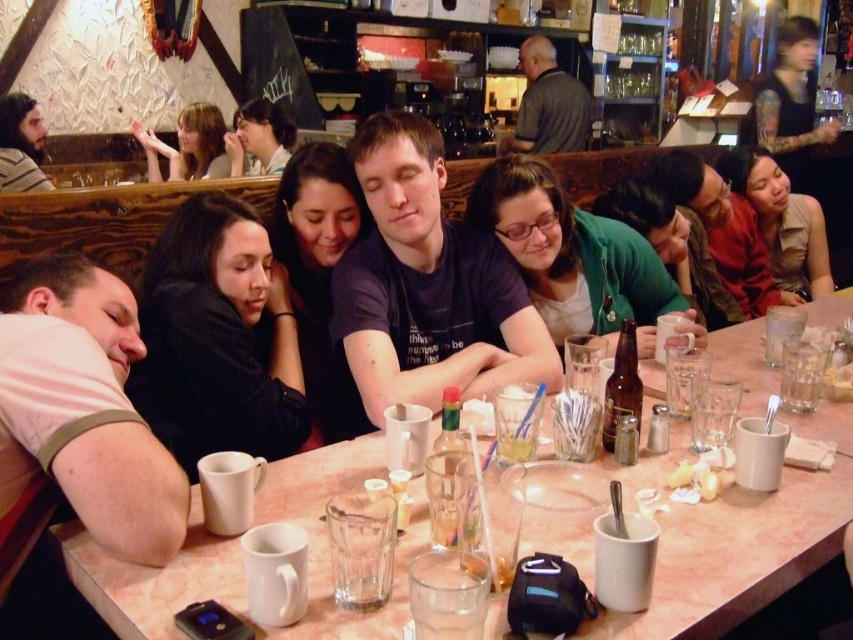
You are a photographer setting up a shoot in this diner scene. You need to ensure that the gray fabric shirt at upper center and the matte black hair at upper left are both in focus. Given their sizes, which object should you adjust your camera focus on first to ensure proper framing?

The gray fabric shirt at upper center has a larger size compared to matte black hair at upper left. Therefore, you should focus on the gray fabric shirt at upper center first since it is bigger and requires more attention in the composition.